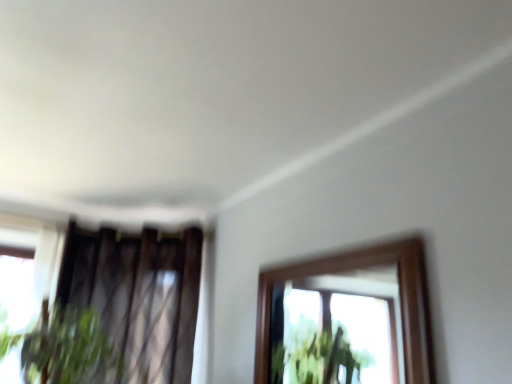
Question: Should I look upward or downward to see dark fabric curtain at left?

Choices:
 (A) up
 (B) down

Answer: (B)